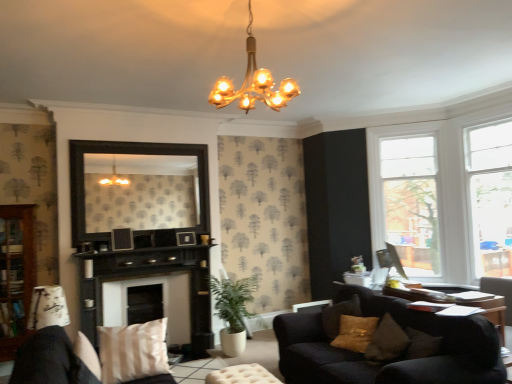
Question: Should I look upward or downward to see gold metallic chandelier at upper center, the second lamp from the back?

Choices:
 (A) up
 (B) down

Answer: (A)

Question: Is beige fabric pillow at lower left to the right of white wood window frame at upper right, the first window frame when ordered from left to right, from the viewer's perspective?

Choices:
 (A) yes
 (B) no

Answer: (B)

Question: Is beige fabric pillow at lower left to the left of white wood window frame at upper right, which is counted as the second window frame, starting from the right, from the viewer's perspective?

Choices:
 (A) no
 (B) yes

Answer: (B)

Question: Can you confirm if beige fabric pillow at lower left is thinner than white wood window frame at upper right, the 1th window frame from the back?

Choices:
 (A) yes
 (B) no

Answer: (B)

Question: From the image's perspective, does beige fabric pillow at lower left appear lower than white wood window frame at upper right, the first window frame when ordered from left to right?

Choices:
 (A) yes
 (B) no

Answer: (A)

Question: Considering the relative sizes of beige fabric pillow at lower left and white wood window frame at upper right, the 1th window frame from the back, in the image provided, is beige fabric pillow at lower left wider than white wood window frame at upper right, the 1th window frame from the back,?

Choices:
 (A) yes
 (B) no

Answer: (A)

Question: Is beige fabric pillow at lower left shorter than white wood window frame at upper right, which is counted as the second window frame, starting from the right?

Choices:
 (A) no
 (B) yes

Answer: (B)

Question: Is beige fabric pillow at lower left positioned with its back to green leafy plant at lower center?

Choices:
 (A) no
 (B) yes

Answer: (A)

Question: Is beige fabric pillow at lower left smaller than green leafy plant at lower center?

Choices:
 (A) no
 (B) yes

Answer: (B)

Question: Does beige fabric pillow at lower left touch green leafy plant at lower center?

Choices:
 (A) no
 (B) yes

Answer: (A)

Question: Considering the relative sizes of beige fabric pillow at lower left and green leafy plant at lower center in the image provided, is beige fabric pillow at lower left shorter than green leafy plant at lower center?

Choices:
 (A) no
 (B) yes

Answer: (B)

Question: Is beige fabric pillow at lower left at the right side of green leafy plant at lower center?

Choices:
 (A) no
 (B) yes

Answer: (A)

Question: From a real-world perspective, is beige fabric pillow at lower left positioned over green leafy plant at lower center based on gravity?

Choices:
 (A) no
 (B) yes

Answer: (B)

Question: Considering the relative positions of dark wood mirror at center and black wood fireplace at center, the second fireplace from the back, in the image provided, is dark wood mirror at center to the left of black wood fireplace at center, the second fireplace from the back, from the viewer's perspective?

Choices:
 (A) yes
 (B) no

Answer: (A)